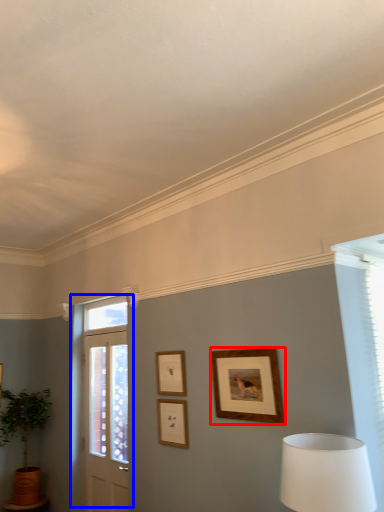
Question: Which object is closer to the camera taking this photo, picture frame (highlighted by a red box) or door (highlighted by a blue box)?

Choices:
 (A) picture frame
 (B) door

Answer: (A)